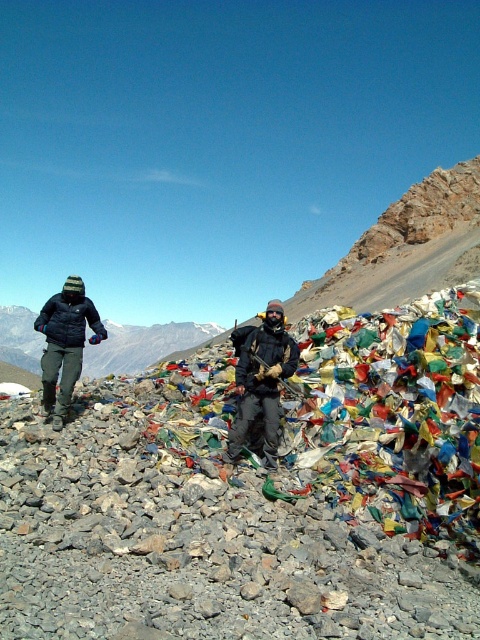
Does dark gray fabric jacket at center appear under matte black jacket at left?

Yes.

Can you confirm if dark gray fabric jacket at center is thinner than matte black jacket at left?

Yes.

Does point (226, 458) come in front of point (88, 324)?

Yes, it is.

At what (x,y) coordinates should I click in order to perform the action: click on dark gray fabric jacket at center. Please return your answer as a coordinate pair (x, y). This screenshot has width=480, height=640. Looking at the image, I should click on (261, 384).